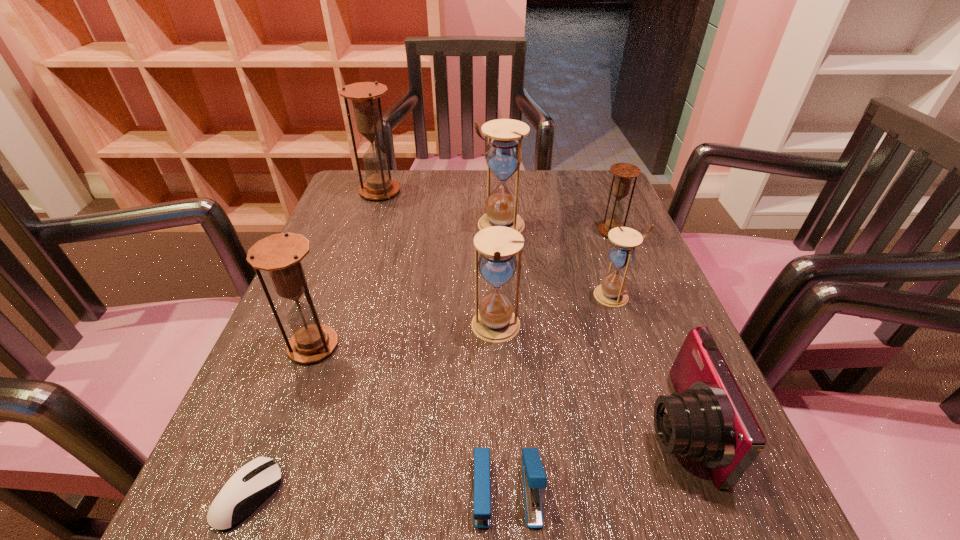
Identify the location of vacant region between the biggest white hourglass and the smallest white hourglass. (558, 260).

Identify the location of free space between the biggest brown hourglass and the nearest brown hourglass. The height and width of the screenshot is (540, 960). (347, 269).

This screenshot has height=540, width=960. Identify the location of unoccupied position between the camera and the second biggest white hourglass. (586, 377).

Identify the location of vacant space in between the seventh tallest object and the biggest brown hourglass. The image size is (960, 540). (528, 309).

Where is `vacant area that lies between the rightmost white hourglass and the second smallest brown hourglass`? vacant area that lies between the rightmost white hourglass and the second smallest brown hourglass is located at coordinates (464, 321).

This screenshot has width=960, height=540. In order to click on free space between the second smallest brown hourglass and the camera in this screenshot , I will do `click(494, 386)`.

The width and height of the screenshot is (960, 540). What are the coordinates of `vacant area that lies between the second farthest brown hourglass and the second biggest white hourglass` in the screenshot? It's located at [x=554, y=280].

Find the location of a particular element. This screenshot has width=960, height=540. vacant space that is in between the eighth tallest object and the smallest white hourglass is located at coordinates (561, 393).

Identify the location of free space that is in between the farthest object and the farthest white hourglass. (440, 208).

Locate which object is the third closest to the farthest brown hourglass. Please provide its 2D coordinates. Your answer should be formatted as a tuple, i.e. [(x, y)], where the tuple contains the x and y coordinates of a point satisfying the conditions above.

[(281, 254)]